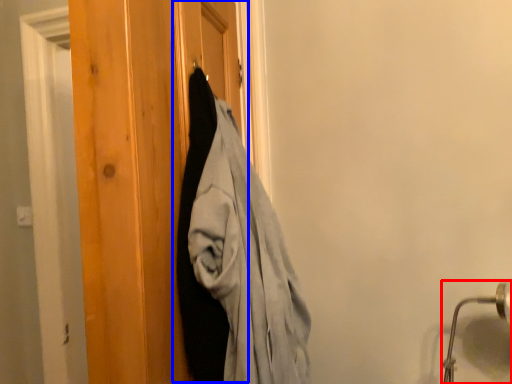
Question: Among these objects, which one is farthest to the camera, door handle (highlighted by a red box) or barn door (highlighted by a blue box)?

Choices:
 (A) door handle
 (B) barn door

Answer: (A)